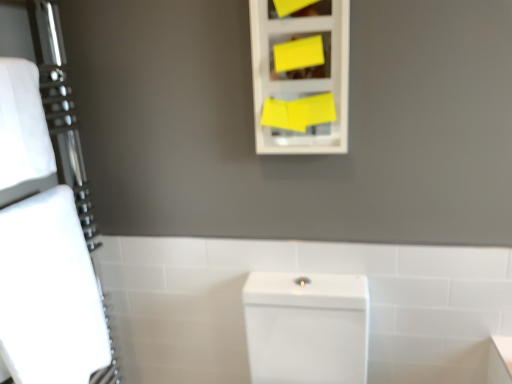
Question: Choose the correct answer: Is white matte bath towel at left, acting as the second bath towel starting from the bottom, inside white glossy toilet at center or outside it?

Choices:
 (A) inside
 (B) outside

Answer: (B)

Question: Is white matte bath towel at left, acting as the second bath towel starting from the bottom, wider or thinner than white glossy toilet at center?

Choices:
 (A) wide
 (B) thin

Answer: (A)

Question: Which object is the closest to the white matte bath towel at left, acting as the second bath towel starting from the bottom?

Choices:
 (A) white glossy toilet at center
 (B) yellow matte cabinet at upper center
 (C) white matte bath towel at left, the first bath towel positioned from the bottom
 (D) white glossy porcelain at center

Answer: (C)

Question: Estimate the real-world distances between objects in this image. Which object is farther from the yellow matte cabinet at upper center?

Choices:
 (A) white matte bath towel at left, acting as the second bath towel starting from the bottom
 (B) white glossy porcelain at center
 (C) white matte bath towel at left, the first bath towel positioned from the bottom
 (D) white glossy toilet at center

Answer: (C)